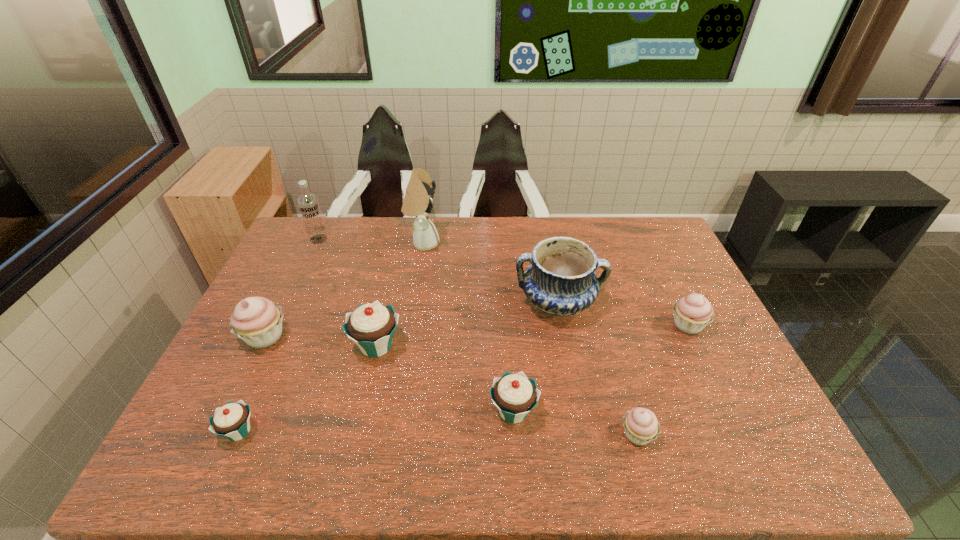
This screenshot has width=960, height=540. I want to click on the fourth cupcake from left to right, so click(x=515, y=395).

This screenshot has height=540, width=960. What are the coordinates of `the rightmost teal cupcake` in the screenshot? It's located at (515, 395).

Identify the location of the leftmost teal cupcake. This screenshot has height=540, width=960. (232, 421).

This screenshot has width=960, height=540. Identify the location of the smallest pink cupcake. (641, 426).

The width and height of the screenshot is (960, 540). I want to click on the second pink cupcake from left to right, so click(641, 426).

The image size is (960, 540). I want to click on vacant space located at the front face of the doll, so click(493, 243).

You are a GUI agent. You are given a task and a screenshot of the screen. Output one action in this format:
    pyautogui.click(x=<x>, y=<y>)
    Task: Click on the blank area located 0.120m on the front label of the eighth shortest object
    The height and width of the screenshot is (540, 960).
    Given the screenshot: What is the action you would take?
    pyautogui.click(x=305, y=267)

I want to click on free space located on the back of the pottery, so click(x=541, y=220).

The height and width of the screenshot is (540, 960). In order to click on vacant position located 0.230m on the front of the biggest pink cupcake in this screenshot , I will do `click(217, 435)`.

The width and height of the screenshot is (960, 540). Find the location of `vacant space located 0.080m on the left of the third cupcake from left to right`. vacant space located 0.080m on the left of the third cupcake from left to right is located at coordinates (322, 346).